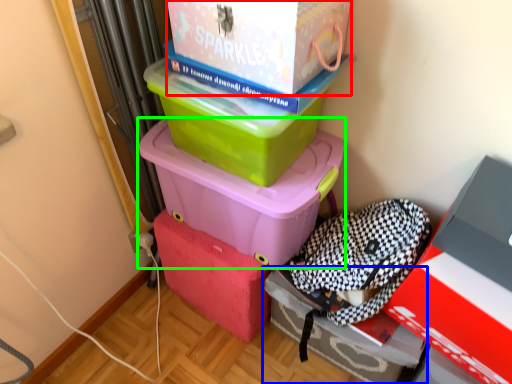
Question: Which object is positioned farthest from box (highlighted by a red box)? Select from box (highlighted by a blue box) and box (highlighted by a green box).

Choices:
 (A) box
 (B) box

Answer: (A)